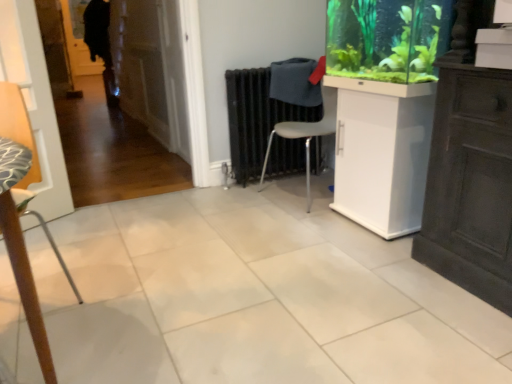
Locate an element on the screen. The height and width of the screenshot is (384, 512). white glossy cabinet at center right is located at coordinates (382, 153).

Describe the element at coordinates (306, 134) in the screenshot. I see `gray plastic chair at center, arranged as the second chair when viewed from the left` at that location.

Describe the element at coordinates (256, 119) in the screenshot. Image resolution: width=512 pixels, height=384 pixels. I see `black metal radiator at center` at that location.

I want to click on white glossy cabinet at center right, so click(x=382, y=153).

You are a GUI agent. You are given a task and a screenshot of the screen. Output one action in this format:
    pyautogui.click(x=<x>, y=<y>)
    Task: Click on the chair that is above the wooden textured chair at left, arranged as the second chair when viewed from the back (from the image's perspective)
    
    Given the screenshot: What is the action you would take?
    pyautogui.click(x=306, y=134)

From the image's perspective, which object appears higher, wooden textured chair at left, arranged as the second chair when viewed from the back, or gray plastic chair at center, which is counted as the 1th chair, starting from the right?

gray plastic chair at center, which is counted as the 1th chair, starting from the right, from the image's perspective.

Between point (45, 372) and point (325, 92), which one is positioned behind?

Point (325, 92)

From a real-world perspective, which object stands above the other?

wooden textured chair at left, which is counted as the first chair, starting from the front.

From the image's perspective, which is below, black metal radiator at center or gray plastic chair at center, which is counted as the 1th chair, starting from the right?

From the image's view, gray plastic chair at center, which is counted as the 1th chair, starting from the right, is below.

Would you say black metal radiator at center is outside gray plastic chair at center, which is counted as the 1th chair, starting from the right?

Yes, black metal radiator at center is not within gray plastic chair at center, which is counted as the 1th chair, starting from the right.

Considering the positions of points (247, 111) and (322, 122), is point (247, 111) closer to camera compared to point (322, 122)?

That is True.

What's the angular difference between black metal radiator at center and gray plastic chair at center, which is counted as the 1th chair, starting from the right,'s facing directions?

black metal radiator at center and gray plastic chair at center, which is counted as the 1th chair, starting from the right, are facing 82.2 degrees away from each other.

Find the location of a particular element. The width and height of the screenshot is (512, 384). chair that is the 2nd object to the left of the white glossy cabinet at center right, starting at the anchor is located at coordinates (22, 212).

Is wooden textured chair at left, which ranks as the 1th chair in left-to-right order, closer to camera compared to white glossy cabinet at center right?

Yes.

From the image's perspective, is wooden textured chair at left, arranged as the second chair when viewed from the back, located beneath white glossy cabinet at center right?

Yes.

Does wooden textured chair at left, arranged as the second chair when viewed from the back, have a smaller size compared to white glossy cabinet at center right?

Yes, wooden textured chair at left, arranged as the second chair when viewed from the back, is smaller than white glossy cabinet at center right.

From the picture: How many degrees apart are the facing directions of black metal radiator at center and white glossy cabinet at center right?

88.1 degrees.

Is white glossy cabinet at center right completely or partially inside black metal radiator at center?

No.

Based on the photo, is black metal radiator at center facing away from white glossy cabinet at center right?

No, black metal radiator at center is not facing away from white glossy cabinet at center right.

Which of these two, black metal radiator at center or white glossy cabinet at center right, is wider?

With larger width is white glossy cabinet at center right.

In the scene shown: How distant is gray plastic chair at center, arranged as the second chair when viewed from the left, from white glossy cabinet at center right?

gray plastic chair at center, arranged as the second chair when viewed from the left, and white glossy cabinet at center right are 19.10 inches apart from each other.

Is white glossy cabinet at center right at the back of gray plastic chair at center, marked as the first chair in a back-to-front arrangement?

No, gray plastic chair at center, marked as the first chair in a back-to-front arrangement, is not facing the opposite direction of white glossy cabinet at center right.

From the image's perspective, which is above, gray plastic chair at center, which ranks as the second chair in front-to-back order, or white glossy cabinet at center right?

From the image's view, gray plastic chair at center, which ranks as the second chair in front-to-back order, is above.

Which object is positioned more to the right, gray plastic chair at center, which is counted as the 1th chair, starting from the right, or white glossy cabinet at center right?

white glossy cabinet at center right.

In terms of size, does gray plastic chair at center, marked as the first chair in a back-to-front arrangement, appear bigger or smaller than green glossy aquarium at upper right?

In the image, gray plastic chair at center, marked as the first chair in a back-to-front arrangement, appears to be larger than green glossy aquarium at upper right.

The width and height of the screenshot is (512, 384). I want to click on plant above the gray plastic chair at center, arranged as the second chair when viewed from the left (from the image's perspective), so [x=386, y=38].

Between gray plastic chair at center, which ranks as the second chair in front-to-back order, and green glossy aquarium at upper right, which one has more height?

gray plastic chair at center, which ranks as the second chair in front-to-back order, is taller.

Considering the sizes of objects black metal radiator at center and wooden textured chair at left, arranged as the second chair when viewed from the back, in the image provided, who is bigger, black metal radiator at center or wooden textured chair at left, arranged as the second chair when viewed from the back,?

Bigger between the two is wooden textured chair at left, arranged as the second chair when viewed from the back.

From the image's perspective, is black metal radiator at center above wooden textured chair at left, which is counted as the first chair, starting from the front?

Yes, from the image's perspective, black metal radiator at center is over wooden textured chair at left, which is counted as the first chair, starting from the front.

Is black metal radiator at center inside or outside of wooden textured chair at left, arranged as the second chair when viewed from the back?

black metal radiator at center cannot be found inside wooden textured chair at left, arranged as the second chair when viewed from the back.

Is black metal radiator at center at the left side of wooden textured chair at left, the second chair positioned from the right?

No.

You are a GUI agent. You are given a task and a screenshot of the screen. Output one action in this format:
    pyautogui.click(x=<x>, y=<y>)
    Task: Click on the chair in front of the gray plastic chair at center, which ranks as the second chair in front-to-back order
    This screenshot has width=512, height=384.
    Given the screenshot: What is the action you would take?
    pyautogui.click(x=22, y=212)

This screenshot has height=384, width=512. I want to click on chair that appears on the right of black metal radiator at center, so click(306, 134).

From the image, which object appears to be farther from green glossy aquarium at upper right, white glossy cabinet at center right or black metal radiator at center?

black metal radiator at center lies further to green glossy aquarium at upper right than the other object.

From the image, which object appears to be farther from gray plastic chair at center, arranged as the second chair when viewed from the left, green glossy aquarium at upper right or black metal radiator at center?

Among the two, green glossy aquarium at upper right is located further to gray plastic chair at center, arranged as the second chair when viewed from the left.

Looking at the image, which one is located closer to white glossy cabinet at center right, black metal radiator at center or gray plastic chair at center, arranged as the second chair when viewed from the left?

Based on the image, gray plastic chair at center, arranged as the second chair when viewed from the left, appears to be nearer to white glossy cabinet at center right.

Based on their spatial positions, is green glossy aquarium at upper right or black metal radiator at center closer to wooden textured chair at left, arranged as the second chair when viewed from the back?

Among the two, black metal radiator at center is located nearer to wooden textured chair at left, arranged as the second chair when viewed from the back.

Estimate the real-world distances between objects in this image. Which object is further from white glossy cabinet at center right, wooden textured chair at left, arranged as the second chair when viewed from the back, or green glossy aquarium at upper right?

Based on the image, wooden textured chair at left, arranged as the second chair when viewed from the back, appears to be further to white glossy cabinet at center right.

When comparing their distances from wooden textured chair at left, which is counted as the first chair, starting from the front, does green glossy aquarium at upper right or gray plastic chair at center, which is counted as the 1th chair, starting from the right, seem further?

Among the two, green glossy aquarium at upper right is located further to wooden textured chair at left, which is counted as the first chair, starting from the front.

Based on their spatial positions, is white glossy cabinet at center right or green glossy aquarium at upper right further from black metal radiator at center?

white glossy cabinet at center right is further to black metal radiator at center.

Looking at the image, which one is located further to gray plastic chair at center, marked as the first chair in a back-to-front arrangement, black metal radiator at center or green glossy aquarium at upper right?

The object further to gray plastic chair at center, marked as the first chair in a back-to-front arrangement, is green glossy aquarium at upper right.

This screenshot has width=512, height=384. I want to click on chair positioned between white glossy cabinet at center right and black metal radiator at center from near to far, so click(306, 134).

At what (x,y) coordinates should I click in order to perform the action: click on chair between green glossy aquarium at upper right and white glossy cabinet at center right in the vertical direction. Please return your answer as a coordinate pair (x, y). Looking at the image, I should click on (306, 134).

Find the location of a particular element. This screenshot has height=384, width=512. chair positioned between green glossy aquarium at upper right and black metal radiator at center from near to far is located at coordinates (306, 134).

Image resolution: width=512 pixels, height=384 pixels. In order to click on radiator located between wooden textured chair at left, which ranks as the 1th chair in left-to-right order, and green glossy aquarium at upper right in the left-right direction in this screenshot , I will do `click(256, 119)`.